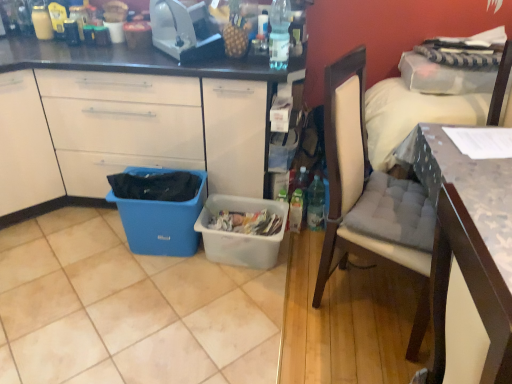
At what (x,y) coordinates should I click in order to perform the action: click on free space that is to the left of light beige fabric chair at right. Please return your answer as a coordinate pair (x, y). Image resolution: width=512 pixels, height=384 pixels. Looking at the image, I should click on (258, 321).